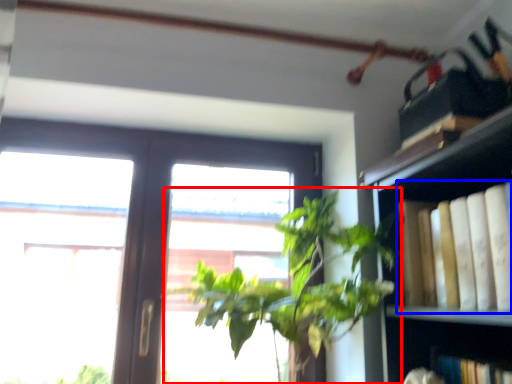
Question: Which object appears closest to the camera in this image, houseplant (highlighted by a red box) or book (highlighted by a blue box)?

Choices:
 (A) houseplant
 (B) book

Answer: (B)